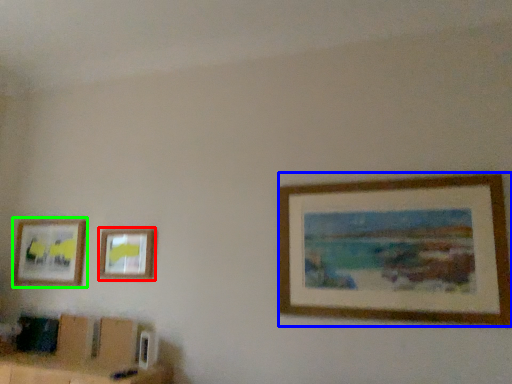
Question: Based on their relative distances, which object is nearer to picture frame (highlighted by a red box)? Choose from picture frame (highlighted by a blue box) and picture frame (highlighted by a green box).

Choices:
 (A) picture frame
 (B) picture frame

Answer: (B)